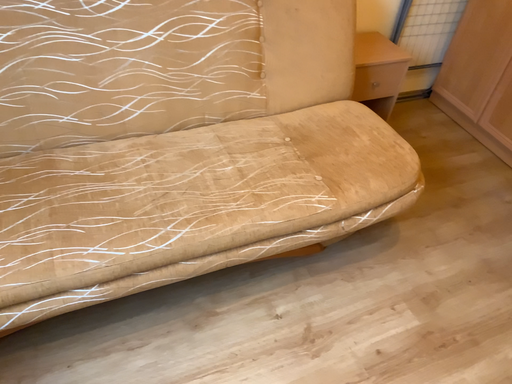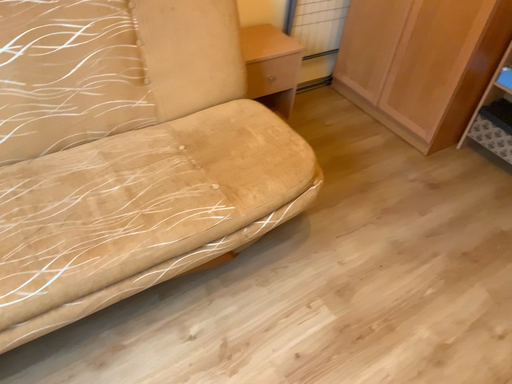
Question: Which way did the camera rotate in the video?

Choices:
 (A) rotated right
 (B) rotated left

Answer: (A)